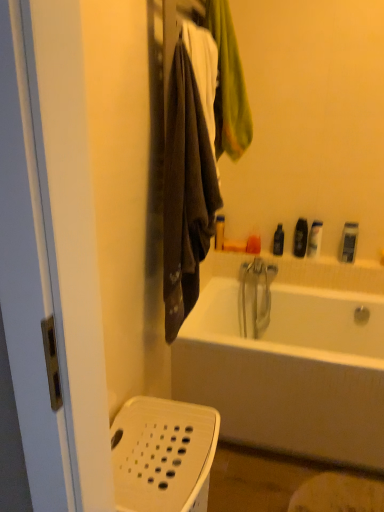
Question: Considering the relative sizes of black plastic bottle at upper right, which is the 4th toiletry in right-to-left order, and orange matte soap at upper center, marked as the 5th toiletry in a right-to-left arrangement, in the image provided, is black plastic bottle at upper right, which is the 4th toiletry in right-to-left order, taller than orange matte soap at upper center, marked as the 5th toiletry in a right-to-left arrangement,?

Choices:
 (A) no
 (B) yes

Answer: (B)

Question: From a real-world perspective, is black plastic bottle at upper right, which is the 4th toiletry in right-to-left order, beneath orange matte soap at upper center, the 2th toiletry positioned from the left?

Choices:
 (A) no
 (B) yes

Answer: (A)

Question: Are black plastic bottle at upper right, the 3th toiletry in the left-to-right sequence, and orange matte soap at upper center, marked as the 5th toiletry in a right-to-left arrangement, far apart?

Choices:
 (A) no
 (B) yes

Answer: (A)

Question: From a real-world perspective, does black plastic bottle at upper right, the 3th toiletry in the left-to-right sequence, stand above orange matte soap at upper center, the 2th toiletry positioned from the left?

Choices:
 (A) no
 (B) yes

Answer: (B)

Question: Is black plastic bottle at upper right, the 3th toiletry in the left-to-right sequence, at the right side of orange matte soap at upper center, marked as the 5th toiletry in a right-to-left arrangement?

Choices:
 (A) no
 (B) yes

Answer: (B)

Question: Is orange matte soap at upper center, marked as the 5th toiletry in a right-to-left arrangement, wider or thinner than black plastic bottle at upper right, which is counted as the third toiletry, starting from the right?

Choices:
 (A) wide
 (B) thin

Answer: (A)

Question: Is orange matte soap at upper center, the 2th toiletry positioned from the left, to the left or to the right of black plastic bottle at upper right, marked as the fourth toiletry in a left-to-right arrangement, in the image?

Choices:
 (A) left
 (B) right

Answer: (A)

Question: From the image's perspective, is orange matte soap at upper center, marked as the 5th toiletry in a right-to-left arrangement, above or below black plastic bottle at upper right, marked as the fourth toiletry in a left-to-right arrangement?

Choices:
 (A) above
 (B) below

Answer: (B)

Question: Is orange matte soap at upper center, marked as the 5th toiletry in a right-to-left arrangement, bigger or smaller than black plastic bottle at upper right, marked as the fourth toiletry in a left-to-right arrangement?

Choices:
 (A) small
 (B) big

Answer: (A)

Question: Choose the correct answer: Is matte plastic soap at upper center, acting as the 6th toiletry starting from the right, inside black plastic bottle at upper right, which is the 4th toiletry in right-to-left order, or outside it?

Choices:
 (A) inside
 (B) outside

Answer: (B)

Question: Considering the positions of matte plastic soap at upper center, acting as the 6th toiletry starting from the right, and black plastic bottle at upper right, which is the 4th toiletry in right-to-left order, in the image, is matte plastic soap at upper center, acting as the 6th toiletry starting from the right, wider or thinner than black plastic bottle at upper right, which is the 4th toiletry in right-to-left order,?

Choices:
 (A) wide
 (B) thin

Answer: (A)

Question: Is matte plastic soap at upper center, positioned as the first toiletry in left-to-right order, in front of or behind black plastic bottle at upper right, the 3th toiletry in the left-to-right sequence, in the image?

Choices:
 (A) front
 (B) behind

Answer: (B)

Question: From a real-world perspective, is matte plastic soap at upper center, acting as the 6th toiletry starting from the right, above or below black plastic bottle at upper right, which is the 4th toiletry in right-to-left order?

Choices:
 (A) above
 (B) below

Answer: (A)

Question: In terms of height, does black plastic bottle at upper right, the 3th toiletry in the left-to-right sequence, look taller or shorter compared to matte plastic soap at upper center, positioned as the first toiletry in left-to-right order?

Choices:
 (A) short
 (B) tall

Answer: (A)

Question: Is black plastic bottle at upper right, the 3th toiletry in the left-to-right sequence, bigger or smaller than matte plastic soap at upper center, acting as the 6th toiletry starting from the right?

Choices:
 (A) big
 (B) small

Answer: (B)